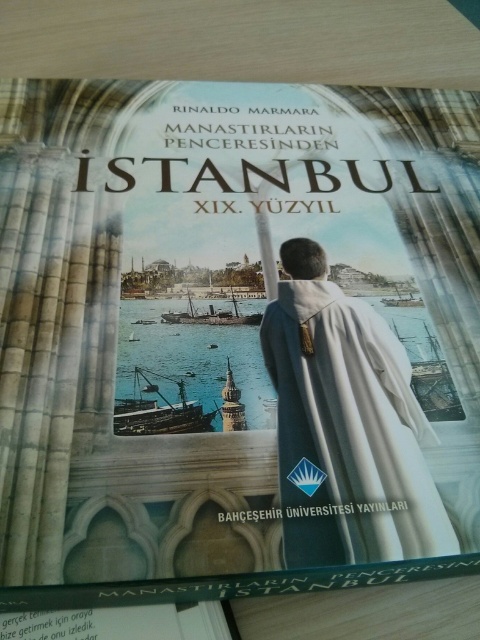
Is white matte robe at center bigger than wooden ship at center?

Indeed, white matte robe at center has a larger size compared to wooden ship at center.

Where is `white matte robe at center`? The width and height of the screenshot is (480, 640). white matte robe at center is located at coordinates (348, 433).

Which is behind, point (345, 419) or point (144, 412)?

The point (144, 412) is more distant.

Image resolution: width=480 pixels, height=640 pixels. What are the coordinates of `white matte robe at center` in the screenshot? It's located at (348, 433).

Is white matte robe at center below metallic sheen steamboat at center?

Yes.

Does white matte robe at center appear over metallic sheen steamboat at center?

No, white matte robe at center is not above metallic sheen steamboat at center.

I want to click on white matte robe at center, so click(348, 433).

Consider the image. Is wooden ship at center taller than metallic sheen steamboat at center?

Indeed, wooden ship at center has a greater height compared to metallic sheen steamboat at center.

From the picture: Does wooden ship at center come in front of metallic sheen steamboat at center?

That is True.

Locate an element on the screen. Image resolution: width=480 pixels, height=640 pixels. wooden ship at center is located at coordinates (158, 410).